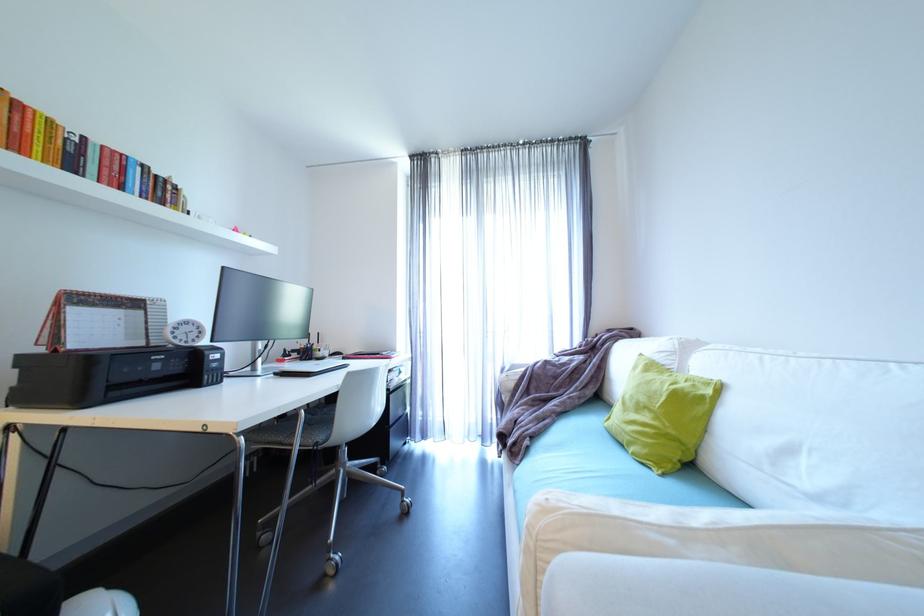
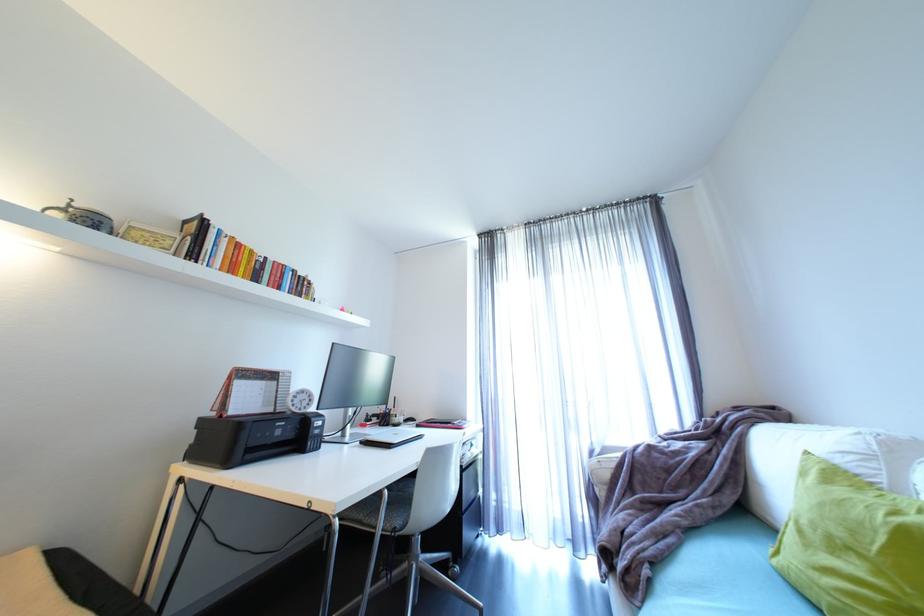
The point at (283, 374) is marked in the first image. Where is the corresponding point in the second image?

(369, 443)